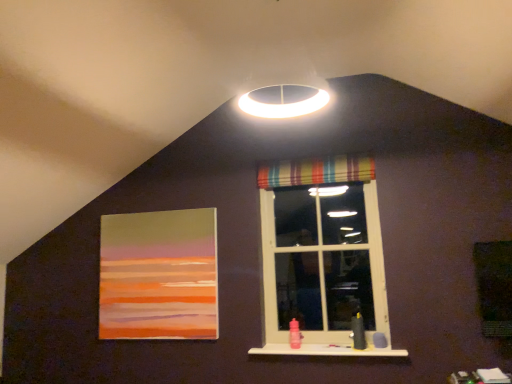
Where is `vacant region under striped fabric curtain at upper center (from a real-world perspective)`? vacant region under striped fabric curtain at upper center (from a real-world perspective) is located at coordinates (320, 343).